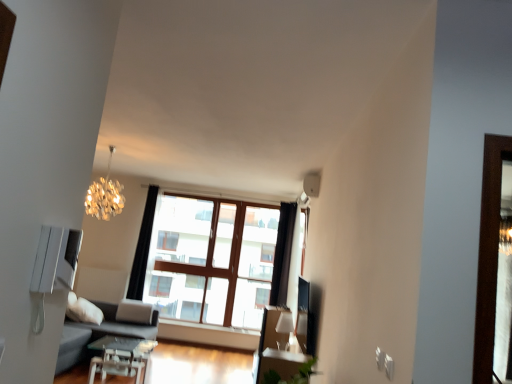
Describe the element at coordinates (119, 337) in the screenshot. This screenshot has width=512, height=384. I see `dark gray fabric couch at lower left` at that location.

Measure the distance between shiny metallic chandelier at upper left, which is the second lamp in bottom-to-top order, and camera.

shiny metallic chandelier at upper left, which is the second lamp in bottom-to-top order, and camera are 4.93 meters apart from each other.

Describe the element at coordinates (208, 258) in the screenshot. I see `clear glass window at center` at that location.

Where is `white glossy lampshade at upper center, the second lamp when ordered from left to right`? white glossy lampshade at upper center, the second lamp when ordered from left to right is located at coordinates (284, 328).

Considering the sizes of objects transparent glass table at center and black fabric curtain at center in the image provided, who is taller, transparent glass table at center or black fabric curtain at center?

Standing taller between the two is black fabric curtain at center.

Is transparent glass table at center at the right side of black fabric curtain at center?

Yes, transparent glass table at center is to the right of black fabric curtain at center.

Is black fabric curtain at center located within transparent glass table at center?

That's incorrect, black fabric curtain at center is not inside transparent glass table at center.

Consider the image. Which object is closer to the camera taking this photo, transparent glass table at center or black fabric curtain at center?

transparent glass table at center is closer to the camera.

Between black fabric curtain at center and dark gray fabric couch at lower left, which one has smaller width?

With smaller width is black fabric curtain at center.

Is black fabric curtain at center positioned far away from dark gray fabric couch at lower left?

Yes.

From the image's perspective, which is above, black fabric curtain at center or dark gray fabric couch at lower left?

black fabric curtain at center, from the image's perspective.

Which is correct: black fabric curtain at center is inside dark gray fabric couch at lower left, or outside of it?

black fabric curtain at center is located beyond the bounds of dark gray fabric couch at lower left.

Is shiny metallic chandelier at upper left, which is the second lamp in bottom-to-top order, located within transparent glass table at center?

No, shiny metallic chandelier at upper left, which is the second lamp in bottom-to-top order, is located outside of transparent glass table at center.

Considering the positions of point (98, 358) and point (112, 207), is point (98, 358) closer or farther from the camera than point (112, 207)?

Point (98, 358) is positioned closer to the camera compared to point (112, 207).

Based on the photo, how different are the orientations of transparent glass table at center and shiny metallic chandelier at upper left, acting as the second lamp starting from the right, in degrees?

The facing directions of transparent glass table at center and shiny metallic chandelier at upper left, acting as the second lamp starting from the right, are 84.7 degrees apart.

Does transparent glass table at center touch shiny metallic chandelier at upper left, which ranks as the first lamp in top-to-bottom order?

They are not placed beside each other.

Identify the location of studio couch located underneath the shiny metallic chandelier at upper left, which ranks as the first lamp in top-to-bottom order (from a real-world perspective). pos(119,337).

From their relative heights in the image, would you say shiny metallic chandelier at upper left, which is the second lamp in bottom-to-top order, is taller or shorter than dark gray fabric couch at lower left?

shiny metallic chandelier at upper left, which is the second lamp in bottom-to-top order, is shorter than dark gray fabric couch at lower left.

From the image's perspective, would you say shiny metallic chandelier at upper left, the 1th lamp from the left, is shown under dark gray fabric couch at lower left?

No, from the image's perspective, shiny metallic chandelier at upper left, the 1th lamp from the left, is not beneath dark gray fabric couch at lower left.

Do you think shiny metallic chandelier at upper left, the 1th lamp from the left, is within dark gray fabric couch at lower left, or outside of it?

shiny metallic chandelier at upper left, the 1th lamp from the left, is not enclosed by dark gray fabric couch at lower left.

Find the location of a particular element. The image size is (512, 384). lamp below the clear glass window at center (from a real-world perspective) is located at coordinates (284, 328).

Considering the sizes of white glossy lampshade at upper center, which ranks as the second lamp in top-to-bottom order, and clear glass window at center in the image, is white glossy lampshade at upper center, which ranks as the second lamp in top-to-bottom order, taller or shorter than clear glass window at center?

white glossy lampshade at upper center, which ranks as the second lamp in top-to-bottom order, is shorter than clear glass window at center.

From the picture: Are white glossy lampshade at upper center, the 1th lamp when ordered from bottom to top, and clear glass window at center making contact?

No, white glossy lampshade at upper center, the 1th lamp when ordered from bottom to top, is not in contact with clear glass window at center.

Is white glossy lampshade at upper center, which ranks as the second lamp in top-to-bottom order, outside of clear glass window at center?

white glossy lampshade at upper center, which ranks as the second lamp in top-to-bottom order, is positioned outside clear glass window at center.

Looking at this image, is dark gray fabric couch at lower left beside clear glass window at center?

No, dark gray fabric couch at lower left is not next to clear glass window at center.

From a real-world perspective, who is located lower, dark gray fabric couch at lower left or clear glass window at center?

In real-world perspective, dark gray fabric couch at lower left is lower.

Is dark gray fabric couch at lower left taller than clear glass window at center?

No.

From the image's perspective, is dark gray fabric couch at lower left on top of clear glass window at center?

Incorrect, from the image's perspective, dark gray fabric couch at lower left is lower than clear glass window at center.

Which object is further away from the camera taking this photo, clear glass window at center or black fabric curtain at center?

clear glass window at center.

From a real-world perspective, who is located higher, clear glass window at center or black fabric curtain at center?

black fabric curtain at center is physically above.

Who is shorter, clear glass window at center or black fabric curtain at center?

black fabric curtain at center is shorter.

Where is `table on the right side of black fabric curtain at center`? This screenshot has height=384, width=512. table on the right side of black fabric curtain at center is located at coordinates (121, 357).

Where is `studio couch located below the black fabric curtain at center (from the image's perspective)`? studio couch located below the black fabric curtain at center (from the image's perspective) is located at coordinates (119, 337).

Considering their positions, is dark gray fabric couch at lower left positioned closer to shiny metallic chandelier at upper left, which is the second lamp in bottom-to-top order, than transparent glass table at center?

dark gray fabric couch at lower left is positioned closer to the anchor shiny metallic chandelier at upper left, which is the second lamp in bottom-to-top order.

When comparing their distances from shiny metallic chandelier at upper left, the 1th lamp from the left, does transparent glass table at center or white glossy lampshade at upper center, the second lamp when ordered from left to right, seem closer?

Based on the image, transparent glass table at center appears to be nearer to shiny metallic chandelier at upper left, the 1th lamp from the left.

Which object lies nearer to the anchor point transparent glass table at center, clear glass window at center or black fabric curtain at center?

Based on the image, black fabric curtain at center appears to be nearer to transparent glass table at center.

Looking at the image, which one is located further to white glossy lampshade at upper center, which ranks as the second lamp in top-to-bottom order, black fabric curtain at center or transparent glass table at center?

black fabric curtain at center is positioned further to the anchor white glossy lampshade at upper center, which ranks as the second lamp in top-to-bottom order.

Estimate the real-world distances between objects in this image. Which object is further from clear glass window at center, transparent glass table at center or shiny metallic chandelier at upper left, which ranks as the first lamp in top-to-bottom order?

Among the two, shiny metallic chandelier at upper left, which ranks as the first lamp in top-to-bottom order, is located further to clear glass window at center.

Looking at the image, which one is located further to dark gray fabric couch at lower left, shiny metallic chandelier at upper left, which is the second lamp in bottom-to-top order, or transparent glass table at center?

shiny metallic chandelier at upper left, which is the second lamp in bottom-to-top order.

Based on their spatial positions, is dark gray fabric couch at lower left or clear glass window at center closer to white glossy lampshade at upper center, the 1th lamp when ordered from bottom to top?

The object closer to white glossy lampshade at upper center, the 1th lamp when ordered from bottom to top, is clear glass window at center.

From the image, which object appears to be farther from shiny metallic chandelier at upper left, which ranks as the first lamp in top-to-bottom order, black fabric curtain at center or white glossy lampshade at upper center, which ranks as the second lamp in top-to-bottom order?

Among the two, white glossy lampshade at upper center, which ranks as the second lamp in top-to-bottom order, is located further to shiny metallic chandelier at upper left, which ranks as the first lamp in top-to-bottom order.

Image resolution: width=512 pixels, height=384 pixels. I want to click on window located between black fabric curtain at center and white glossy lampshade at upper center, the 1th lamp when ordered from bottom to top, in the left-right direction, so click(208, 258).

Locate an element on the screen. studio couch between transparent glass table at center and black fabric curtain at center in the front-back direction is located at coordinates (119, 337).

Identify the location of lamp between shiny metallic chandelier at upper left, which ranks as the first lamp in top-to-bottom order, and transparent glass table at center vertically. (284, 328).

Where is `curtain between transparent glass table at center and clear glass window at center along the z-axis`? Image resolution: width=512 pixels, height=384 pixels. curtain between transparent glass table at center and clear glass window at center along the z-axis is located at coordinates (143, 246).